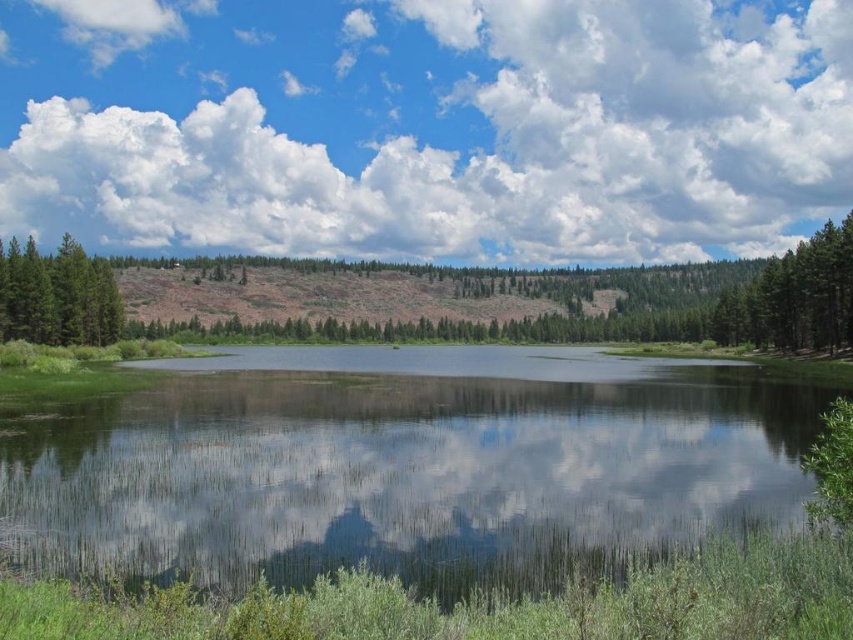
Question: Does green grassy lake at center appear on the left side of green matte tree at left?

Choices:
 (A) yes
 (B) no

Answer: (B)

Question: Which object is positioned closest to the cloudy sky at upper center?

Choices:
 (A) green grassy lake at center
 (B) green matte tree at left

Answer: (B)

Question: Where is cloudy sky at upper center located in relation to green matte tree at left in the image?

Choices:
 (A) below
 (B) above

Answer: (B)

Question: Which object is farther from the camera taking this photo?

Choices:
 (A) cloudy sky at upper center
 (B) green grassy lake at center
 (C) green matte tree at left

Answer: (A)

Question: Which object is farther from the camera taking this photo?

Choices:
 (A) green matte tree at left
 (B) green grassy lake at center
 (C) cloudy sky at upper center

Answer: (C)

Question: Where is cloudy sky at upper center located in relation to green grassy lake at center in the image?

Choices:
 (A) left
 (B) right

Answer: (B)